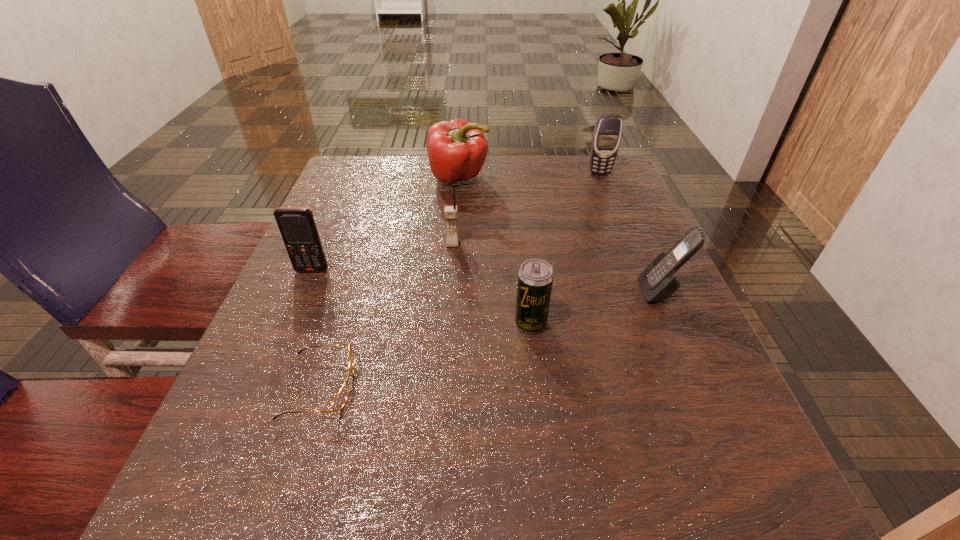
The image size is (960, 540). Find the location of `spectacles`. spectacles is located at coordinates (340, 399).

Where is `free space located 0.170m on the front face of the farthest cellular telephone`? The height and width of the screenshot is (540, 960). free space located 0.170m on the front face of the farthest cellular telephone is located at coordinates 615,212.

Identify the location of vacant area located 0.130m on the left of the bell pepper. This screenshot has width=960, height=540. click(x=379, y=177).

At what (x,y) coordinates should I click in order to perform the action: click on vacant area situated on the screen of the third farthest cellular telephone. Please return your answer as a coordinate pair (x, y). Looking at the image, I should click on (254, 406).

This screenshot has height=540, width=960. What are the coordinates of `free space located on the front of the second cellular telephone from left to right, where the keypad is located` in the screenshot? It's located at (448, 304).

Where is `vacant position located 0.170m on the front-facing side of the third nearest object`? vacant position located 0.170m on the front-facing side of the third nearest object is located at coordinates (552, 292).

You are a GUI agent. You are given a task and a screenshot of the screen. Output one action in this format:
    pyautogui.click(x=<x>, y=<y>)
    Task: Click on the free space located on the front-facing side of the third nearest object
    The image size is (960, 540).
    Given the screenshot: What is the action you would take?
    point(511,292)

Image resolution: width=960 pixels, height=540 pixels. Find the location of `vacant space located on the front-facing side of the third nearest object`. vacant space located on the front-facing side of the third nearest object is located at coordinates (558, 292).

Image resolution: width=960 pixels, height=540 pixels. Find the location of `vacant region located 0.180m on the right of the sixth farthest object`. vacant region located 0.180m on the right of the sixth farthest object is located at coordinates (647, 323).

The width and height of the screenshot is (960, 540). Find the location of `vacant space situated on the front-facing side of the spectacles`. vacant space situated on the front-facing side of the spectacles is located at coordinates (417, 386).